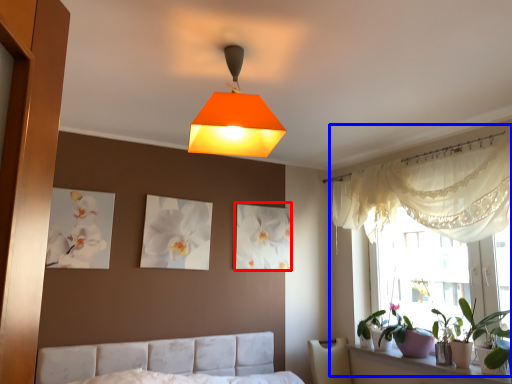
Question: Which object appears farthest to the camera in this image, picture frame (highlighted by a red box) or bay window (highlighted by a blue box)?

Choices:
 (A) picture frame
 (B) bay window

Answer: (A)